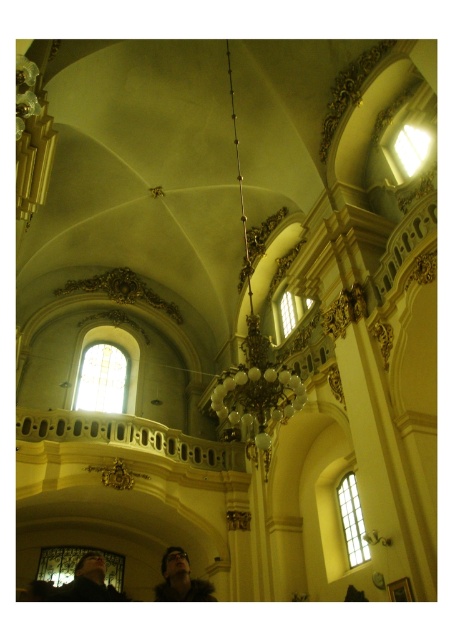
Between dark brown hair at lower center and dark brown leather jacket at lower left, which one is positioned higher?

Positioned higher is dark brown leather jacket at lower left.

Does dark brown hair at lower center appear under dark brown leather jacket at lower left?

Correct, dark brown hair at lower center is located below dark brown leather jacket at lower left.

I want to click on dark brown hair at lower center, so click(x=181, y=579).

The width and height of the screenshot is (455, 640). I want to click on dark brown hair at lower center, so click(181, 579).